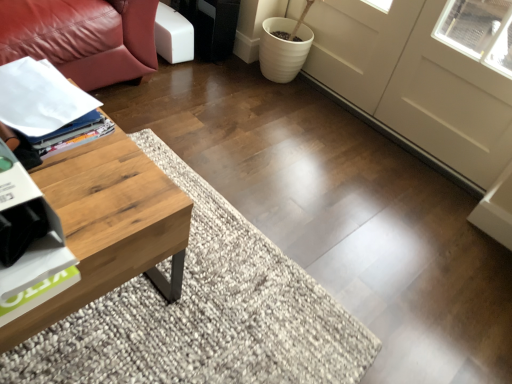
You are a GUI agent. You are given a task and a screenshot of the screen. Output one action in this format:
    pyautogui.click(x=<x>, y=<y>)
    Task: Click on the vacant space in front of white matte screen door at center
    Image resolution: width=512 pixels, height=384 pixels.
    Given the screenshot: What is the action you would take?
    pyautogui.click(x=366, y=197)